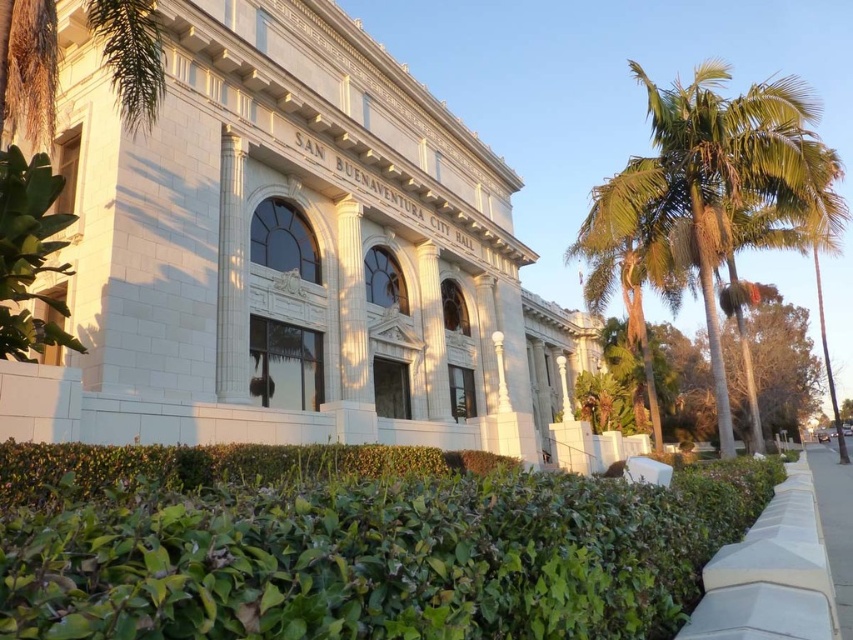
Can you confirm if green leafy hedge at lower center is positioned below green leafy tree at right?

Incorrect, green leafy hedge at lower center is not positioned below green leafy tree at right.

Between green leafy hedge at lower center and green leafy tree at right, which one is positioned lower?

Positioned lower is green leafy tree at right.

Between point (102, 522) and point (732, 358), which one is positioned in front?

Point (102, 522) is in front.

Find the location of a particular element. green leafy hedge at lower center is located at coordinates (378, 557).

This screenshot has width=853, height=640. Find the location of `green leafy tree at right`. green leafy tree at right is located at coordinates pos(782,365).

Is point (592, 392) closer to camera compared to point (830, 548)?

No, (592, 392) is behind (830, 548).

The image size is (853, 640). Identify the location of green leafy tree at right. (782, 365).

Who is more forward, (x=86, y=560) or (x=817, y=456)?

Positioned in front is point (x=86, y=560).

Can you confirm if green leafy hedge at lower center is smaller than white concrete pavement at lower right?

Correct, green leafy hedge at lower center occupies less space than white concrete pavement at lower right.

Between point (641, 506) and point (831, 577), which one is positioned behind?

Positioned behind is point (831, 577).

Identify the location of green leafy hedge at lower center. click(378, 557).